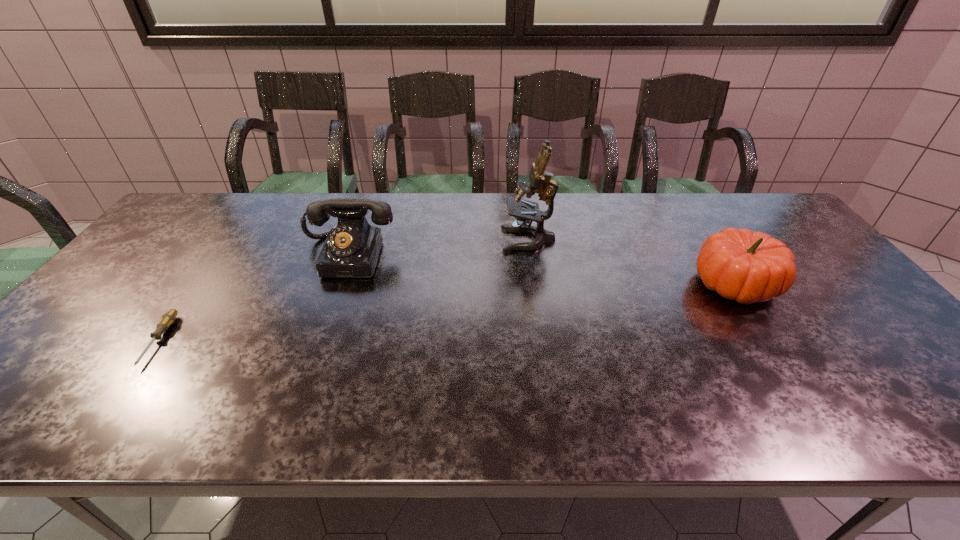
Where is `free area in between the second object from left to right and the leftmost object`? The width and height of the screenshot is (960, 540). free area in between the second object from left to right and the leftmost object is located at coordinates (253, 298).

Image resolution: width=960 pixels, height=540 pixels. Find the location of `empty space that is in between the third object from left to right and the second object from left to right`. empty space that is in between the third object from left to right and the second object from left to right is located at coordinates (439, 248).

This screenshot has height=540, width=960. Find the location of `unoccupied area between the pumpkin and the second object from left to right`. unoccupied area between the pumpkin and the second object from left to right is located at coordinates (541, 270).

Find the location of a particular element. The width and height of the screenshot is (960, 540). vacant area that lies between the third object from right to left and the rightmost object is located at coordinates click(x=541, y=270).

Image resolution: width=960 pixels, height=540 pixels. Find the location of `free space between the microscope and the telephone`. free space between the microscope and the telephone is located at coordinates (439, 248).

Find the location of a particular element. free space between the rightmost object and the telephone is located at coordinates (541, 270).

Where is `vacant point located between the pumpkin and the third object from left to right`? vacant point located between the pumpkin and the third object from left to right is located at coordinates (632, 262).

The width and height of the screenshot is (960, 540). Find the location of `vacant space in between the screwdriver and the pumpkin`. vacant space in between the screwdriver and the pumpkin is located at coordinates (446, 313).

Locate an element on the screen. The image size is (960, 540). free area in between the telephone and the pumpkin is located at coordinates click(x=541, y=270).

Locate which object ranks in proximity to the screwdriver. Please provide its 2D coordinates. Your answer should be formatted as a tuple, i.e. [(x, y)], where the tuple contains the x and y coordinates of a point satisfying the conditions above.

[(351, 250)]